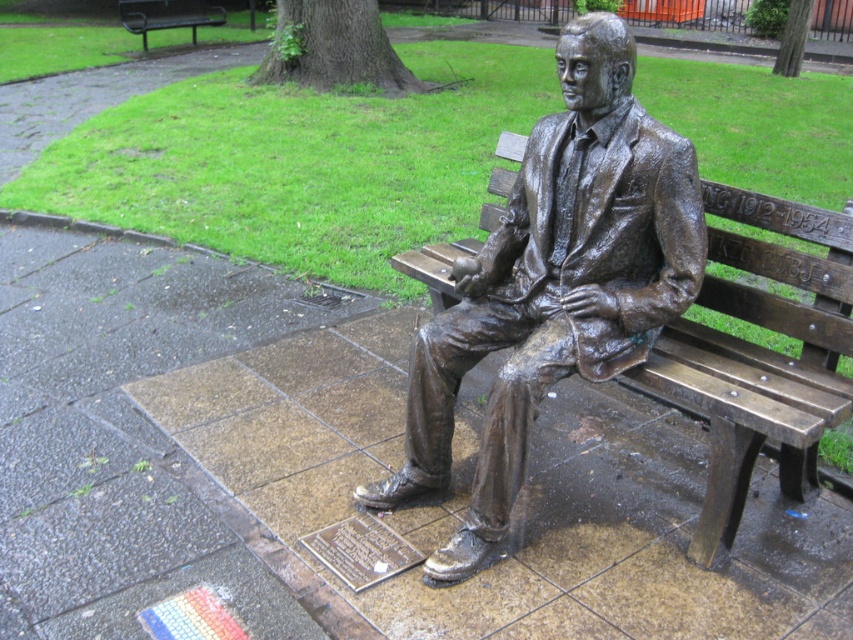
Question: Is bronze statue at center further to camera compared to bronze bench at upper left?

Choices:
 (A) no
 (B) yes

Answer: (A)

Question: In this image, where is bronze statue at center located relative to bronze bench at upper left?

Choices:
 (A) left
 (B) right

Answer: (B)

Question: Does bronze statue at center appear on the right side of bronze bench at upper left?

Choices:
 (A) no
 (B) yes

Answer: (B)